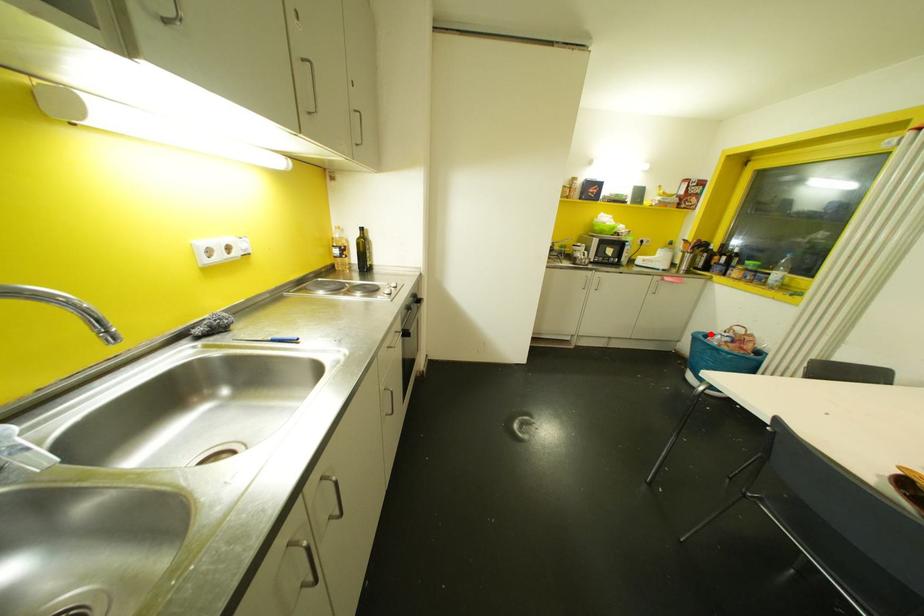
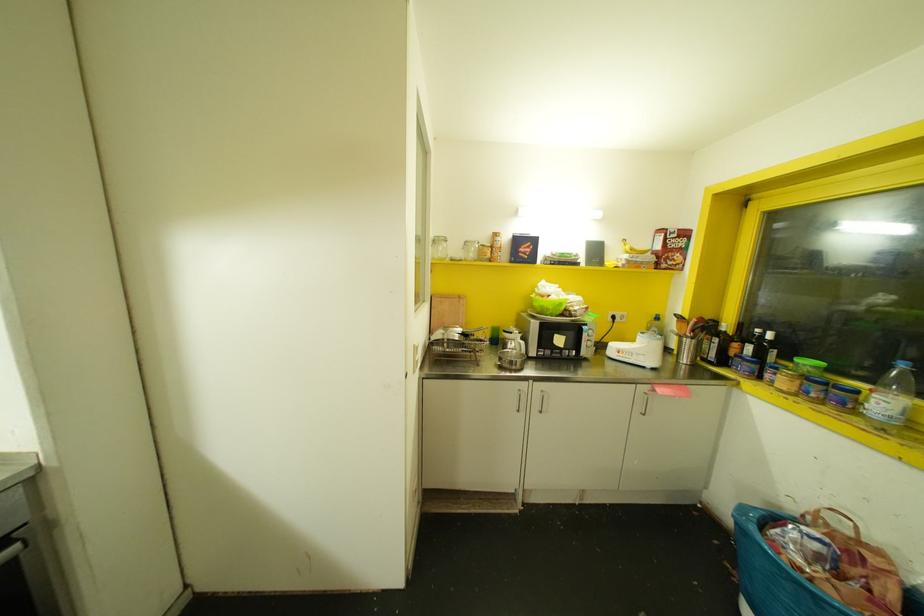
Where in the second image is the point corresponding to the highlighted location from the first image?

(773, 517)